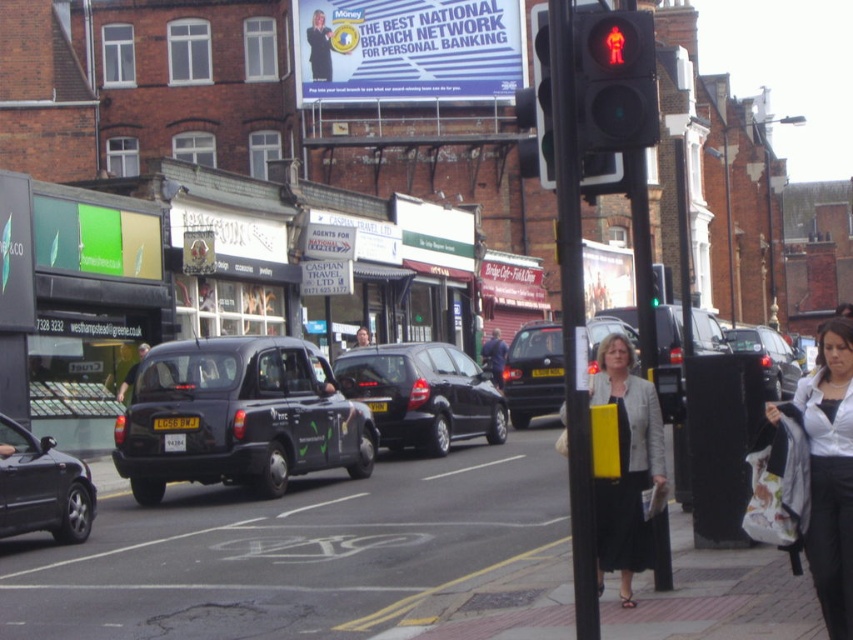
You are a pedestrian standing at the pedestrian crossing signal in the foreground. You want to cross the street to the Bridge Cafe. The black matte taxi at left is blocking your path. Can you safely walk around the taxi to reach the dark blue jacket at center without getting too close?

The black matte taxi at left and dark blue jacket at center are 64.73 feet apart. Since the distance between them is quite large, you can safely walk around the taxi to reach the dark blue jacket at center while maintaining a safe distance.

You are a delivery person who needs to attach a sign to the black plastic pole at center and the matte gray blazer at center. Which object will require a longer rope to reach its top?

The black plastic pole at center is much taller as matte gray blazer at center, so the black plastic pole at center will require a longer rope to reach its top.